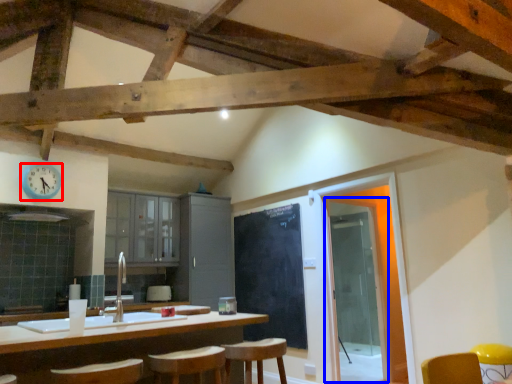
Question: Which object is further to the camera taking this photo, clock (highlighted by a red box) or glass door (highlighted by a blue box)?

Choices:
 (A) clock
 (B) glass door

Answer: (B)